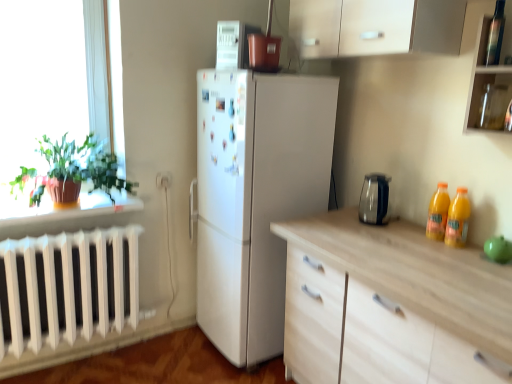
Question: From the image's perspective, is orange plastic bottles at right, the 2th bottle in the bottom-to-top sequence, above or below green matte plant at left?

Choices:
 (A) below
 (B) above

Answer: (A)

Question: Does point (434, 231) appear closer or farther from the camera than point (31, 168)?

Choices:
 (A) farther
 (B) closer

Answer: (B)

Question: Which object is positioned closest to the green matte plant at left?

Choices:
 (A) transparent plastic bottle at upper right, which appears as the 1th bottle when viewed from the top
 (B) yellow glass bottles at right, the 3th bottle in the top-to-bottom sequence
 (C) transparent glass cabinet at upper right
 (D) white plastic electric outlet at lower center
 (E) white glossy microwave at upper center

Answer: (D)

Question: Which object is the closest to the orange plastic bottles at right, the 2th bottle in the bottom-to-top sequence?

Choices:
 (A) transparent plastic bottle at upper right, which appears as the 1th bottle when viewed from the top
 (B) transparent glass jar at upper right
 (C) transparent glass cabinet at upper right
 (D) green matte plant at left
 (E) white plastic electric outlet at lower center

Answer: (B)